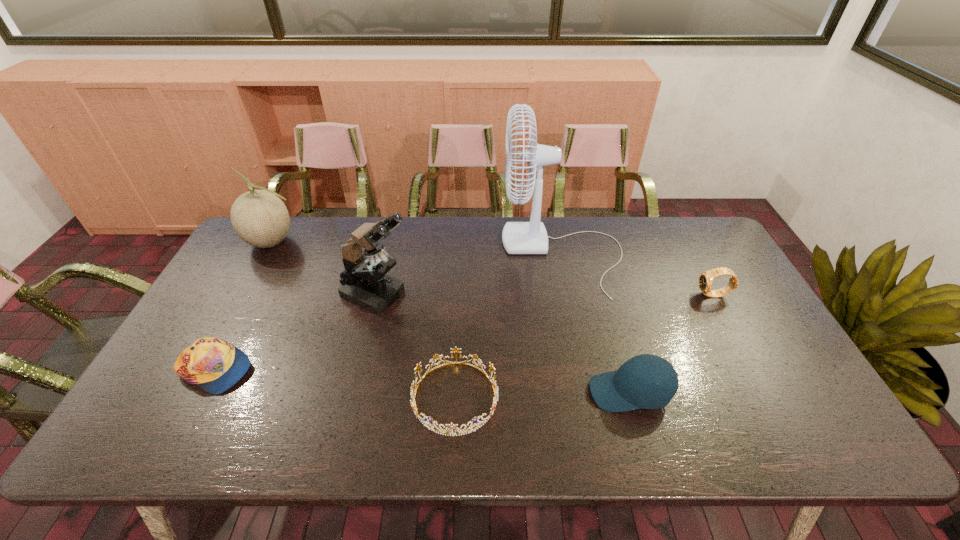
This screenshot has height=540, width=960. I want to click on vacant space located 0.070m on the bill of the cap, so click(x=279, y=370).

The height and width of the screenshot is (540, 960). Identify the location of fan present at the far edge. (531, 237).

You are a GUI agent. You are given a task and a screenshot of the screen. Output one action in this format:
    pyautogui.click(x=<x>, y=<y>)
    Task: Click on the cantaloup that is positioned at the far edge
    The image size is (960, 540).
    Given the screenshot: What is the action you would take?
    pyautogui.click(x=260, y=218)

Where is `object at the near edge`? object at the near edge is located at coordinates (449, 429).

Where is `cantaloup present at the left edge`? This screenshot has width=960, height=540. cantaloup present at the left edge is located at coordinates (260, 218).

The image size is (960, 540). What are the coordinates of `cap that is at the left edge` in the screenshot? It's located at pyautogui.click(x=215, y=365).

In order to click on object located at the right edge in this screenshot , I will do `click(705, 282)`.

Locate an element on the screen. Image resolution: width=960 pixels, height=540 pixels. object that is at the far left corner is located at coordinates (260, 218).

Identify the location of blank space at the far edge of the desktop. Image resolution: width=960 pixels, height=540 pixels. (452, 241).

Image resolution: width=960 pixels, height=540 pixels. In the image, there is a desktop. Identify the location of vacant space at the left edge. (235, 295).